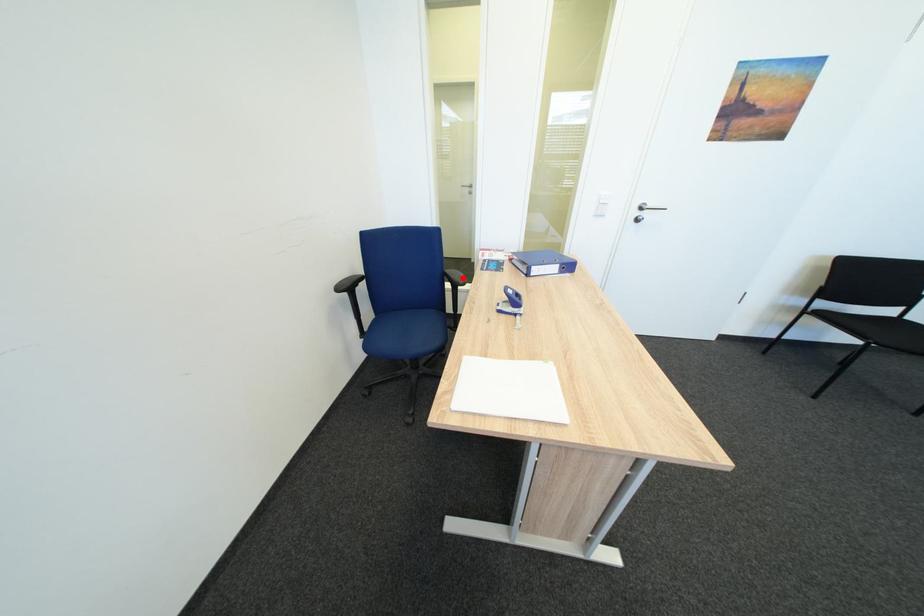
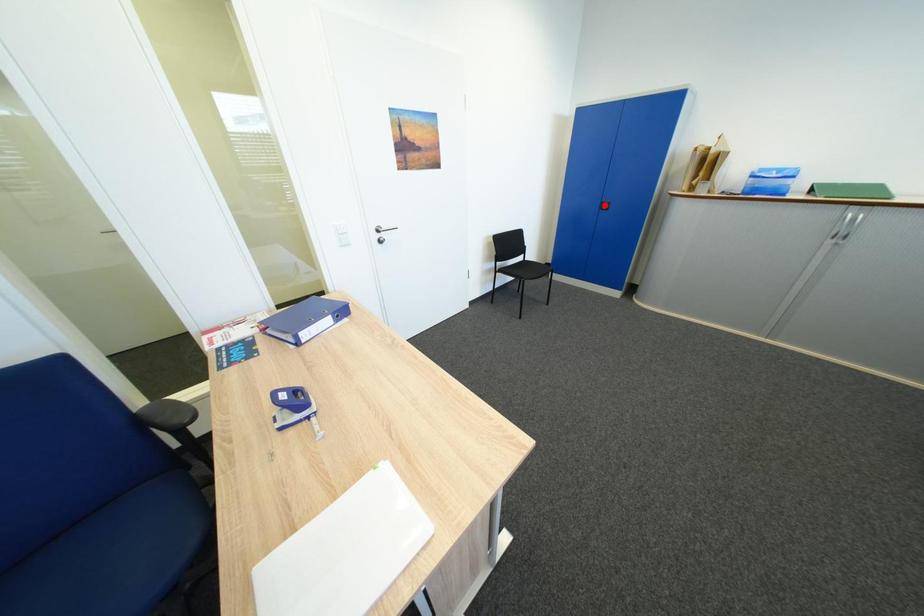
I am providing you with two images of the same scene from different viewpoints. A red point is marked on the first image and another point is marked on the second image. Is the marked point in image1 the same physical position as the marked point in image2?

No